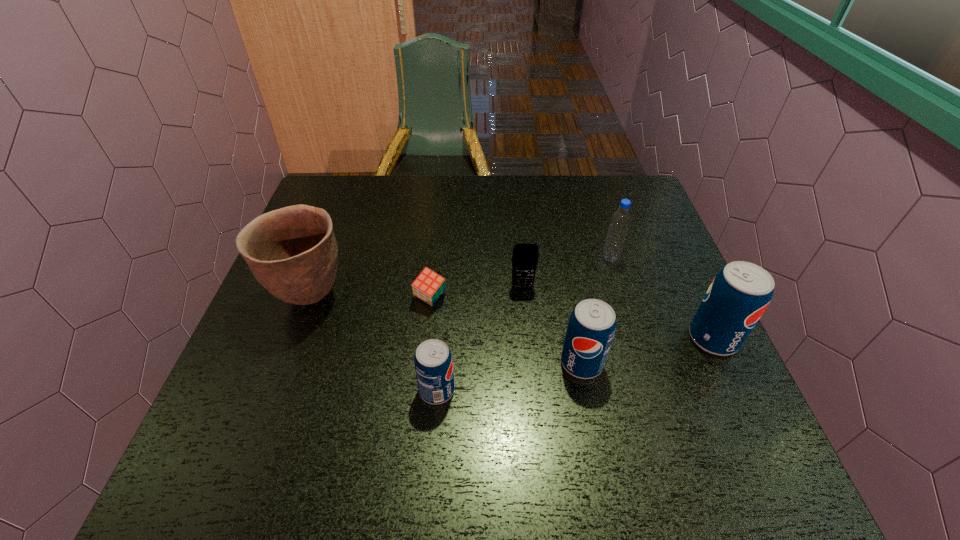
Locate an element on the screen. The image size is (960, 540). free space between the pottery and the cube is located at coordinates (371, 298).

Find the location of a particular element. blank region between the shortest object and the fourth object from right to left is located at coordinates (476, 292).

The image size is (960, 540). In order to click on vacant space that is in between the second pop from right to left and the pottery in this screenshot , I will do `click(446, 330)`.

Where is `vacant area that lies between the cube and the third object from right to left`? The height and width of the screenshot is (540, 960). vacant area that lies between the cube and the third object from right to left is located at coordinates (506, 330).

Where is `empty space between the second shortest pop and the rightmost pop`? This screenshot has width=960, height=540. empty space between the second shortest pop and the rightmost pop is located at coordinates (647, 350).

Identify the location of object identified as the fifth closest to the tallest pop. (428, 286).

Select which object appears as the third closest to the shortest object. Please provide its 2D coordinates. Your answer should be formatted as a tuple, i.e. [(x, y)], where the tuple contains the x and y coordinates of a point satisfying the conditions above.

[(433, 362)]

You are a GUI agent. You are given a task and a screenshot of the screen. Output one action in this format:
    pyautogui.click(x=<x>, y=<y>)
    Task: Click on the second closest pop relative to the fifth object from left to right
    The height and width of the screenshot is (540, 960).
    Given the screenshot: What is the action you would take?
    pyautogui.click(x=433, y=362)

Locate an element on the screen. This screenshot has height=540, width=960. pop that is the second closest to the sixth object from left to right is located at coordinates (591, 328).

Where is `free location that satisfies the following two spatial constraints: 1. on the screen of the second pop from right to left; 2. on the right side of the cellular telephone`? Image resolution: width=960 pixels, height=540 pixels. free location that satisfies the following two spatial constraints: 1. on the screen of the second pop from right to left; 2. on the right side of the cellular telephone is located at coordinates (530, 363).